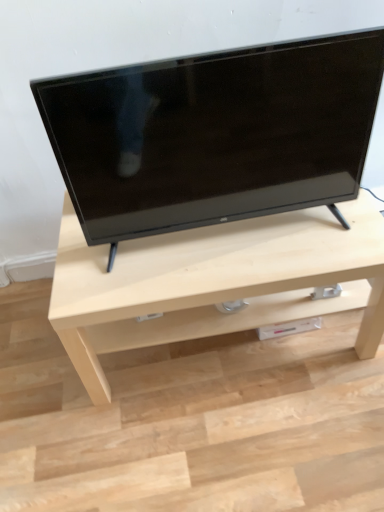
At what (x,y) coordinates should I click in order to perform the action: click on black glossy tv at center. Please return your answer as a coordinate pair (x, y). Looking at the image, I should click on (214, 135).

Measure the distance between point [160,99] and camera.

The distance of point [160,99] from camera is 35.63 inches.

Describe the element at coordinates (214, 135) in the screenshot. The height and width of the screenshot is (512, 384). I see `black glossy tv at center` at that location.

In order to face black glossy tv at center, should I rotate leftwards or rightwards?

To align with it, rotate right about 2.913°.

The height and width of the screenshot is (512, 384). Identify the location of light wood table at center. (214, 282).

This screenshot has height=512, width=384. What do you see at coordinates (214, 282) in the screenshot?
I see `light wood table at center` at bounding box center [214, 282].

The width and height of the screenshot is (384, 512). I want to click on black glossy tv at center, so coord(214,135).

Can you confirm if black glossy tv at center is positioned to the right of light wood table at center?

Incorrect, black glossy tv at center is not on the right side of light wood table at center.

Is black glossy tv at center in front of or behind light wood table at center in the image?

black glossy tv at center is positioned closer to the viewer than light wood table at center.

Does point (220, 143) appear closer or farther from the camera than point (225, 237)?

Clearly, point (220, 143) is closer to the camera than point (225, 237).

From the image's perspective, is black glossy tv at center above or below light wood table at center?

Clearly, from the image's perspective, black glossy tv at center is above light wood table at center.

From the picture: From a real-world perspective, is black glossy tv at center on light wood table at center?

Yes, from a real-world perspective, black glossy tv at center is above light wood table at center.

Can you confirm if black glossy tv at center is thinner than light wood table at center?

Yes, black glossy tv at center is thinner than light wood table at center.

Does black glossy tv at center have a greater height compared to light wood table at center?

Indeed, black glossy tv at center has a greater height compared to light wood table at center.

Can you confirm if black glossy tv at center is bigger than light wood table at center?

Actually, black glossy tv at center might be smaller than light wood table at center.

Would you say light wood table at center is part of black glossy tv at center's contents?

No.

Is black glossy tv at center placed right next to light wood table at center?

No, black glossy tv at center is not in contact with light wood table at center.

Is black glossy tv at center turned away from light wood table at center?

No.

From the picture: How different are the orientations of black glossy tv at center and light wood table at center in degrees?

They differ by 1.27 degrees in their facing directions.

I want to click on table below the black glossy tv at center (from a real-world perspective), so click(214, 282).

Does light wood table at center appear on the right side of black glossy tv at center?

Yes, light wood table at center is to the right of black glossy tv at center.

Is light wood table at center behind black glossy tv at center?

Yes, light wood table at center is further from the viewer.

Is point (61, 338) closer or farther from the camera than point (364, 123)?

Point (61, 338) is positioned farther from the camera compared to point (364, 123).

From the image's perspective, which is below, light wood table at center or black glossy tv at center?

light wood table at center.

From a real-world perspective, is light wood table at center positioned above or below black glossy tv at center?

Clearly, from a real-world perspective, light wood table at center is below black glossy tv at center.

Is light wood table at center wider than black glossy tv at center?

Yes, light wood table at center is wider than black glossy tv at center.

Considering the sizes of objects light wood table at center and black glossy tv at center in the image provided, who is taller, light wood table at center or black glossy tv at center?

black glossy tv at center.

Can you confirm if light wood table at center is smaller than black glossy tv at center?

Incorrect, light wood table at center is not smaller in size than black glossy tv at center.

Would you say light wood table at center is outside black glossy tv at center?

light wood table at center is positioned outside black glossy tv at center.

Consider the image. Are light wood table at center and black glossy tv at center located far from each other?

No, there isn't a large distance between light wood table at center and black glossy tv at center.

Is light wood table at center facing towards black glossy tv at center?

No, light wood table at center is not facing towards black glossy tv at center.

What's the angular difference between light wood table at center and black glossy tv at center's facing directions?

1.27 degrees separate the facing orientations of light wood table at center and black glossy tv at center.

In order to click on television above the light wood table at center (from a real-world perspective) in this screenshot , I will do `click(214, 135)`.

Where is `table that appears below the black glossy tv at center (from a real-world perspective)`? table that appears below the black glossy tv at center (from a real-world perspective) is located at coordinates (214, 282).

Where is `table that is behind the black glossy tv at center`? Image resolution: width=384 pixels, height=512 pixels. table that is behind the black glossy tv at center is located at coordinates (214, 282).